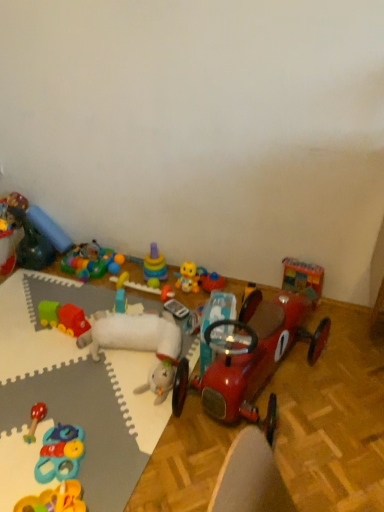
At what (x,y) coordinates should I click in order to perform the action: click on vacant space underneath shiny red car at center, marked as the eleventh toy in a left-to-right arrangement (from a real-world perspective). Please return your answer as a coordinate pair (x, y). The image size is (384, 512). Looking at the image, I should click on (270, 388).